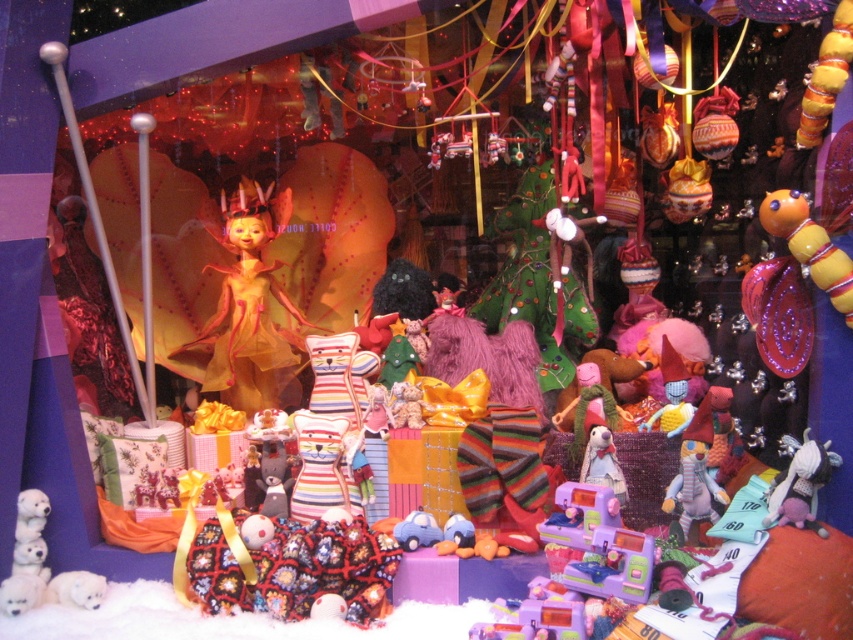
You are a customer in a toy store looking at the festive display. You want to buy a gift for a child. Which item, the matte orange fabric doll at center or the striped woolen hat at center, would you recommend if the child prefers larger toys?

The matte orange fabric doll at center is larger than the striped woolen hat at center, so it would be the better recommendation for a child who prefers larger toys.

You are a toy store employee who needs to place a new shelf that is 36 inches wide between the matte orange fabric doll at center and the striped woolen hat at center. Can the shelf fit between them without overlapping either item?

The matte orange fabric doll at center is 37.34 inches from the striped woolen hat at center. Since the shelf is 36 inches wide, it can fit between them as the distance between the two items is greater than the shelf width.

You are standing in front of a festive toy store window display. You notice two points marked in the scene. The first point is at coordinates point (283,342), and the second is at point (704,429). Which of these two points is closer to you?

Point (283,342) is further to the viewer than point (704,429), so the point closer to you is point (704,429).